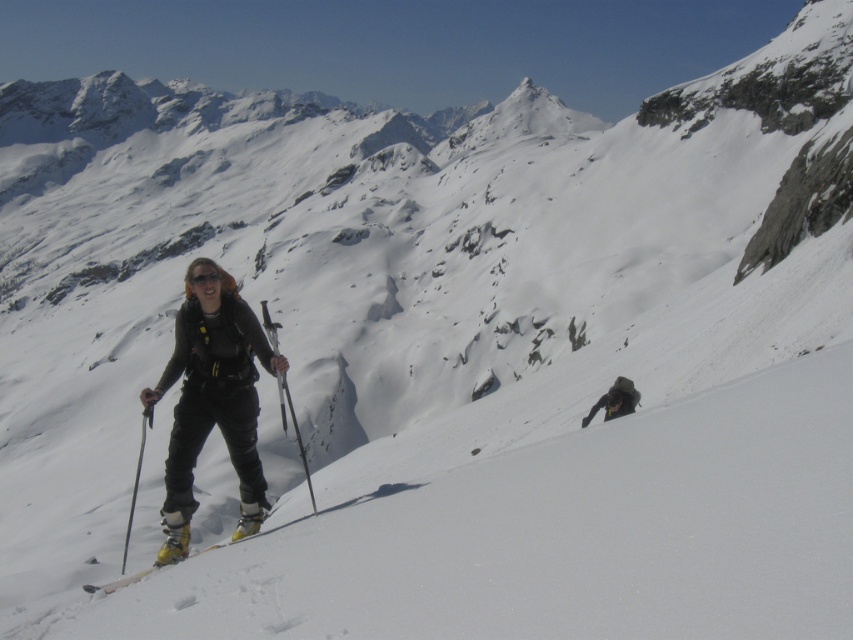
Question: Which object appears farthest from the camera in this image?

Choices:
 (A) matte black ski suit at center
 (B) transparent plastic goggles at center
 (C) matte black ski pole at center

Answer: (B)

Question: Estimate the real-world distances between objects in this image. Which object is farther from the dark green jacket at lower right?

Choices:
 (A) matte black ski suit at center
 (B) transparent plastic goggles at center

Answer: (B)

Question: Where is white snow ski slope at center located in relation to dark green jacket at lower right in the image?

Choices:
 (A) right
 (B) left

Answer: (B)

Question: Among these points, which one is farthest from the camera?

Choices:
 (A) (271, 339)
 (B) (622, 576)

Answer: (A)

Question: Does yellow matte ski at center appear on the left side of transparent plastic goggles at center?

Choices:
 (A) no
 (B) yes

Answer: (B)

Question: Is white snow ski slope at center positioned in front of yellow matte ski at center?

Choices:
 (A) no
 (B) yes

Answer: (B)